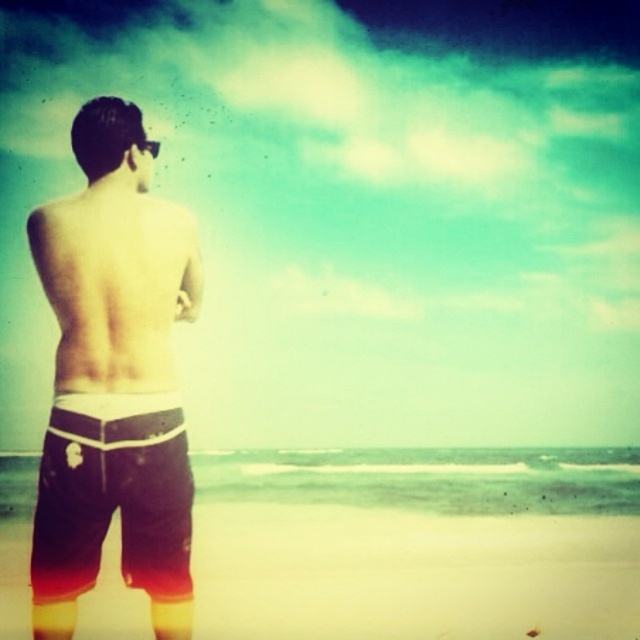
Between dark brown shorts at left and beige sand at lower center, which one appears on the right side from the viewer's perspective?

dark brown shorts at left is more to the right.

You are a GUI agent. You are given a task and a screenshot of the screen. Output one action in this format:
    pyautogui.click(x=<x>, y=<y>)
    Task: Click on the dark brown shorts at left
    This screenshot has width=640, height=640.
    Given the screenshot: What is the action you would take?
    pyautogui.click(x=113, y=378)